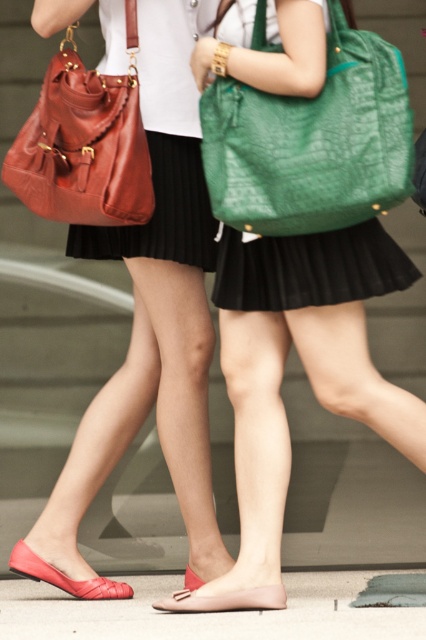
Can you confirm if green textured tote at upper center is positioned above matte pink leather sandal at lower center?

Correct, green textured tote at upper center is located above matte pink leather sandal at lower center.

Between green textured tote at upper center and matte pink leather sandal at lower center, which one has more height?

green textured tote at upper center

Is point (255, 218) behind point (176, 595)?

No, it is in front of (176, 595).

This screenshot has width=426, height=640. I want to click on green textured tote at upper center, so click(x=311, y=141).

Is matte leather shoulder bag at left above matte pink leather sandal at lower center?

Indeed, matte leather shoulder bag at left is positioned over matte pink leather sandal at lower center.

Which is behind, point (143, 216) or point (252, 596)?

The point (143, 216) is behind.

Identify the location of matte leather shoulder bag at left. Image resolution: width=426 pixels, height=640 pixels. (85, 144).

Is smooth concrete pavement at lower center to the right of matte red sandal at lower left from the viewer's perspective?

Correct, you'll find smooth concrete pavement at lower center to the right of matte red sandal at lower left.

Can you confirm if smooth concrete pavement at lower center is shorter than matte red sandal at lower left?

Correct, smooth concrete pavement at lower center is not as tall as matte red sandal at lower left.

Does point (328, 628) come behind point (49, 577)?

No, it is not.

The image size is (426, 640). What are the coordinates of `smooth concrete pavement at lower center` in the screenshot? It's located at (216, 612).